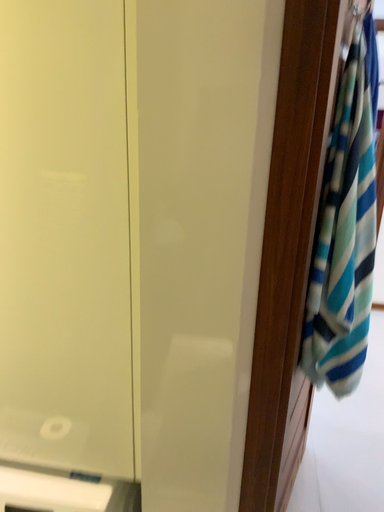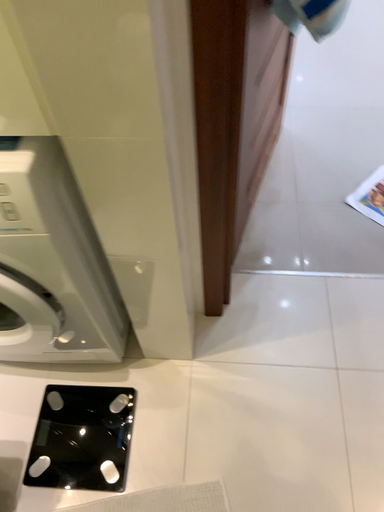
Question: How did the camera likely rotate when shooting the video?

Choices:
 (A) rotated downward
 (B) rotated upward

Answer: (A)